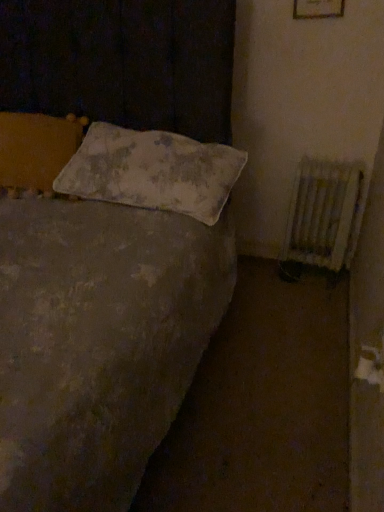
What do you see at coordinates (152, 170) in the screenshot?
I see `white fabric pillow at center` at bounding box center [152, 170].

Identify the location of white fabric pillow at center. (152, 170).

The height and width of the screenshot is (512, 384). I want to click on white painted metal radiator at right, so click(325, 213).

The height and width of the screenshot is (512, 384). What do you see at coordinates (325, 213) in the screenshot?
I see `white painted metal radiator at right` at bounding box center [325, 213].

Locate an element on the screen. This screenshot has height=512, width=384. white fabric pillow at center is located at coordinates (152, 170).

Which is more to the right, white painted metal radiator at right or white fabric pillow at center?

white painted metal radiator at right.

Does white painted metal radiator at right lie behind white fabric pillow at center?

Yes, the depth of white painted metal radiator at right is greater than that of white fabric pillow at center.

Which is closer, (359,189) or (210,145)?

Point (359,189) is farther from the camera than point (210,145).

From the image's perspective, is white painted metal radiator at right located beneath white fabric pillow at center?

Yes, from the image's perspective, white painted metal radiator at right is below white fabric pillow at center.

Looking at this image, from a real-world perspective, between white painted metal radiator at right and white fabric pillow at center, who is vertically lower?

In real-world perspective, white painted metal radiator at right is lower.

Which of these two, white painted metal radiator at right or white fabric pillow at center, is thinner?

white painted metal radiator at right.

In terms of height, does white painted metal radiator at right look taller or shorter compared to white fabric pillow at center?

In the image, white painted metal radiator at right appears to be taller than white fabric pillow at center.

Considering the sizes of objects white painted metal radiator at right and white fabric pillow at center in the image provided, who is smaller, white painted metal radiator at right or white fabric pillow at center?

With smaller size is white painted metal radiator at right.

Is white painted metal radiator at right completely or partially outside of white fabric pillow at center?

Absolutely, white painted metal radiator at right is external to white fabric pillow at center.

Can you see white painted metal radiator at right touching white fabric pillow at center?

They are not placed beside each other.

Is white painted metal radiator at right looking in the opposite direction of white fabric pillow at center?

No, white painted metal radiator at right's orientation is not away from white fabric pillow at center.

What's the angular difference between white painted metal radiator at right and white fabric pillow at center's facing directions?

0.364 degrees.

Identify the location of radiator below the white fabric pillow at center (from the image's perspective). (325, 213).

Does white fabric pillow at center appear on the right side of white painted metal radiator at right?

In fact, white fabric pillow at center is to the left of white painted metal radiator at right.

Is white fabric pillow at center in front of or behind white painted metal radiator at right in the image?

Clearly, white fabric pillow at center is in front of white painted metal radiator at right.

Which is farther from the camera, (236,151) or (325,206)?

Positioned behind is point (325,206).

From the image's perspective, which is below, white fabric pillow at center or white painted metal radiator at right?

white painted metal radiator at right appears lower in the image.

In the scene shown: From a real-world perspective, is white fabric pillow at center over white painted metal radiator at right?

Yes, from a real-world perspective, white fabric pillow at center is over white painted metal radiator at right

Does white fabric pillow at center have a lesser width compared to white painted metal radiator at right?

No, white fabric pillow at center is not thinner than white painted metal radiator at right.

Is white fabric pillow at center taller or shorter than white painted metal radiator at right?

Clearly, white fabric pillow at center is shorter compared to white painted metal radiator at right.

Considering the sizes of white fabric pillow at center and white painted metal radiator at right in the image, is white fabric pillow at center bigger or smaller than white painted metal radiator at right?

white fabric pillow at center is bigger than white painted metal radiator at right.

Would you say white fabric pillow at center is inside or outside white painted metal radiator at right?

white fabric pillow at center exists outside the volume of white painted metal radiator at right.

Are white fabric pillow at center and white painted metal radiator at right far apart?

That's not correct — white fabric pillow at center is a little close to white painted metal radiator at right.

Is white fabric pillow at center facing towards white painted metal radiator at right?

No, white fabric pillow at center is not turned towards white painted metal radiator at right.

Can you tell me how much white fabric pillow at center and white painted metal radiator at right differ in facing direction?

0.364 degrees.

Where is `radiator lying below the white fabric pillow at center (from the image's perspective)`? The image size is (384, 512). radiator lying below the white fabric pillow at center (from the image's perspective) is located at coordinates (325, 213).

At what (x,y) coordinates should I click in order to perform the action: click on pillow in front of the white painted metal radiator at right. Please return your answer as a coordinate pair (x, y). Looking at the image, I should click on (152, 170).

Find the location of `pillow above the white painted metal radiator at right (from a real-world perspective)`. pillow above the white painted metal radiator at right (from a real-world perspective) is located at coordinates (152, 170).